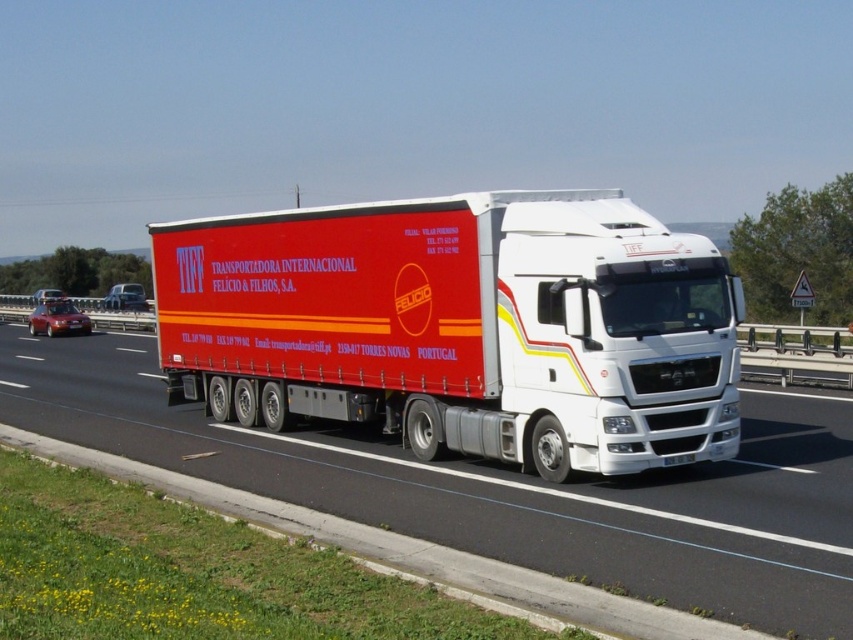
From the picture: Between white matte trailer truck at center and red matte truck at center, which one has more height?

With more height is white matte trailer truck at center.

Which is more to the left, white matte trailer truck at center or red matte truck at center?

Positioned to the left is red matte truck at center.

Locate an element on the screen. The height and width of the screenshot is (640, 853). white matte trailer truck at center is located at coordinates (461, 326).